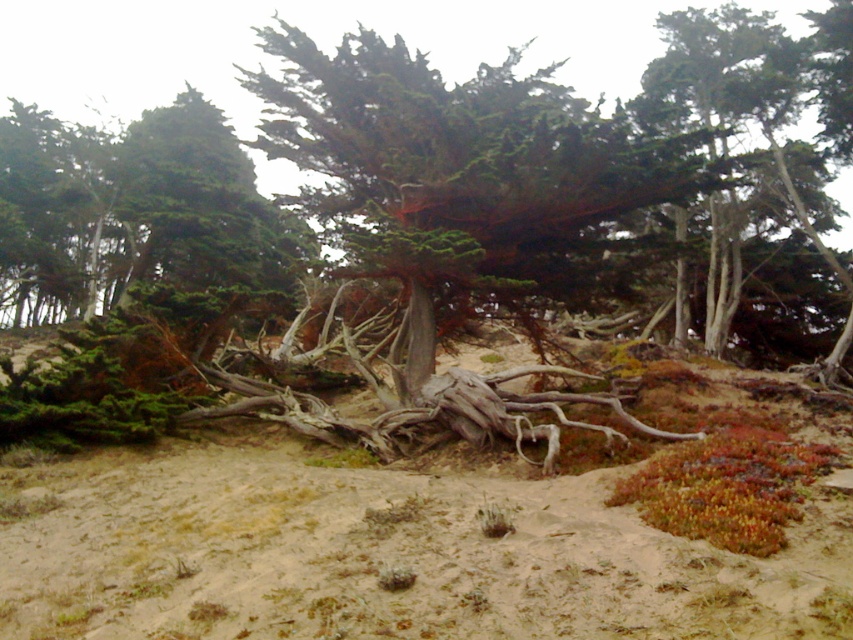
You are standing at the edge of the sandy area and want to walk towards the green textured cypress tree at center. Which direction should you move relative to the brown textured sand at center?

Since the brown textured sand at center is to the right of the green textured cypress tree at center, you should move to the left of the brown textured sand at center to reach the green textured cypress tree at center.